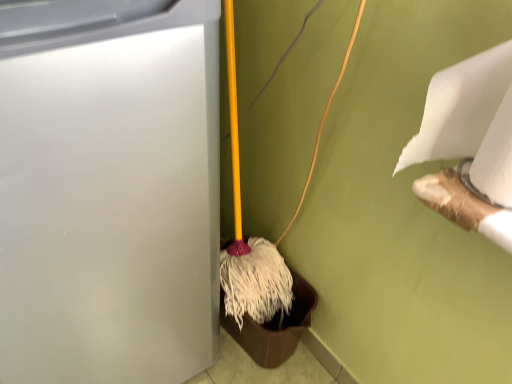
Locate an element on the screen. white matte toilet paper at upper right, placed as the 2th toilet paper when sorted from right to left is located at coordinates (460, 107).

Measure the distance between point (496, 183) and camera.

Point (496, 183) and camera are 21.14 inches apart from each other.

The width and height of the screenshot is (512, 384). What do you see at coordinates (108, 189) in the screenshot?
I see `white matte waste container at left` at bounding box center [108, 189].

Where is `white matte toilet paper at upper right, positioned as the 1th toilet paper in left-to-right order`? The height and width of the screenshot is (384, 512). white matte toilet paper at upper right, positioned as the 1th toilet paper in left-to-right order is located at coordinates [x=460, y=107].

In the scene shown: Which of these two, white matte toilet paper at upper right, positioned as the 1th toilet paper in left-to-right order, or white matte waste container at left, is bigger?

Bigger between the two is white matte waste container at left.

Consider the image. Which is correct: white matte toilet paper at upper right, positioned as the 1th toilet paper in left-to-right order, is inside white matte waste container at left, or outside of it?

white matte toilet paper at upper right, positioned as the 1th toilet paper in left-to-right order, cannot be found inside white matte waste container at left.

From the image's perspective, is white matte toilet paper at upper right, positioned as the 1th toilet paper in left-to-right order, above white matte waste container at left?

Indeed, from the image's perspective, white matte toilet paper at upper right, positioned as the 1th toilet paper in left-to-right order, is shown above white matte waste container at left.

Based on the photo, is white matte toilet paper at upper right, positioned as the 1th toilet paper in left-to-right order, taller than white matte waste container at left?

Incorrect, the height of white matte toilet paper at upper right, positioned as the 1th toilet paper in left-to-right order, is not larger of that of white matte waste container at left.

Locate an element on the screen. toilet paper that appears in front of the white matte toilet paper at upper right, positioned as the 1th toilet paper in left-to-right order is located at coordinates (495, 158).

Is white matte toilet paper at upper right, positioned as the 1th toilet paper in left-to-right order, next to white matte toilet paper at upper right, which is the 1th toilet paper in right-to-left order?

Yes, white matte toilet paper at upper right, positioned as the 1th toilet paper in left-to-right order, is right next to white matte toilet paper at upper right, which is the 1th toilet paper in right-to-left order, and making contact.

From the image's perspective, does white matte toilet paper at upper right, placed as the 2th toilet paper when sorted from right to left, appear lower than white matte toilet paper at upper right, which is the second toilet paper in left-to-right order?

Correct, white matte toilet paper at upper right, placed as the 2th toilet paper when sorted from right to left, appears lower than white matte toilet paper at upper right, which is the second toilet paper in left-to-right order, in the image.

Find the location of `waste container lying on the left of white matte toilet paper at upper right, which is the 1th toilet paper in right-to-left order`. waste container lying on the left of white matte toilet paper at upper right, which is the 1th toilet paper in right-to-left order is located at coordinates (108, 189).

Is white matte toilet paper at upper right, which is the 1th toilet paper in right-to-left order, wider or thinner than white matte waste container at left?

Considering their sizes, white matte toilet paper at upper right, which is the 1th toilet paper in right-to-left order, looks slimmer than white matte waste container at left.

From a real-world perspective, who is located higher, white matte toilet paper at upper right, which is the 1th toilet paper in right-to-left order, or white matte waste container at left?

white matte toilet paper at upper right, which is the 1th toilet paper in right-to-left order, from a real-world perspective.

Does point (508, 175) come closer to viewer compared to point (54, 251)?

Yes.

Do you think white matte toilet paper at upper right, which is the second toilet paper in left-to-right order, is within white matte toilet paper at upper right, placed as the 2th toilet paper when sorted from right to left, or outside of it?

white matte toilet paper at upper right, which is the second toilet paper in left-to-right order, is inside white matte toilet paper at upper right, placed as the 2th toilet paper when sorted from right to left.

How many degrees apart are the facing directions of white matte toilet paper at upper right, which is the second toilet paper in left-to-right order, and white matte toilet paper at upper right, positioned as the 1th toilet paper in left-to-right order?

The angle between the facing direction of white matte toilet paper at upper right, which is the second toilet paper in left-to-right order, and the facing direction of white matte toilet paper at upper right, positioned as the 1th toilet paper in left-to-right order, is 0.978 degrees.

From the image's perspective, is white matte toilet paper at upper right, which is the second toilet paper in left-to-right order, positioned above or below white matte toilet paper at upper right, placed as the 2th toilet paper when sorted from right to left?

white matte toilet paper at upper right, which is the second toilet paper in left-to-right order, is above white matte toilet paper at upper right, placed as the 2th toilet paper when sorted from right to left.

Identify the location of toilet paper behind the white matte toilet paper at upper right, which is the 1th toilet paper in right-to-left order. The width and height of the screenshot is (512, 384). (460, 107).

Is white matte waste container at left positioned far away from white matte toilet paper at upper right, which is the 1th toilet paper in right-to-left order?

That's not correct — white matte waste container at left is a little close to white matte toilet paper at upper right, which is the 1th toilet paper in right-to-left order.

From the picture: Can you confirm if white matte waste container at left is shorter than white matte toilet paper at upper right, which is the 1th toilet paper in right-to-left order?

No.

Is white matte waste container at left positioned with its back to white matte toilet paper at upper right, which is the 1th toilet paper in right-to-left order?

That's not correct — white matte waste container at left is not looking away from white matte toilet paper at upper right, which is the 1th toilet paper in right-to-left order.

Who is smaller, white matte waste container at left or white matte toilet paper at upper right, placed as the 2th toilet paper when sorted from right to left?

white matte toilet paper at upper right, placed as the 2th toilet paper when sorted from right to left, is smaller.

Between white matte waste container at left and white matte toilet paper at upper right, placed as the 2th toilet paper when sorted from right to left, which one appears on the left side from the viewer's perspective?

Positioned to the left is white matte waste container at left.

Could you measure the distance between white matte waste container at left and white matte toilet paper at upper right, positioned as the 1th toilet paper in left-to-right order?

A distance of 19.24 inches exists between white matte waste container at left and white matte toilet paper at upper right, positioned as the 1th toilet paper in left-to-right order.

What's the angular difference between white matte waste container at left and white matte toilet paper at upper right, placed as the 2th toilet paper when sorted from right to left,'s facing directions?

They differ by 90.6 degrees in their facing directions.

Identify the location of waste container below the white matte toilet paper at upper right, positioned as the 1th toilet paper in left-to-right order (from the image's perspective). (108, 189).

Image resolution: width=512 pixels, height=384 pixels. In order to click on toilet paper behind the white matte toilet paper at upper right, which is the second toilet paper in left-to-right order in this screenshot , I will do `click(460, 107)`.

Estimate the real-world distances between objects in this image. Which object is closer to white matte waste container at left, white matte toilet paper at upper right, which is the 1th toilet paper in right-to-left order, or white matte toilet paper at upper right, placed as the 2th toilet paper when sorted from right to left?

white matte toilet paper at upper right, placed as the 2th toilet paper when sorted from right to left, is closer to white matte waste container at left.

Based on their spatial positions, is white matte toilet paper at upper right, placed as the 2th toilet paper when sorted from right to left, or white matte waste container at left closer to white matte toilet paper at upper right, which is the 1th toilet paper in right-to-left order?

The object closer to white matte toilet paper at upper right, which is the 1th toilet paper in right-to-left order, is white matte toilet paper at upper right, placed as the 2th toilet paper when sorted from right to left.

Consider the image. Which object lies further to the anchor point white matte toilet paper at upper right, positioned as the 1th toilet paper in left-to-right order, white matte waste container at left or white matte toilet paper at upper right, which is the second toilet paper in left-to-right order?

white matte waste container at left is positioned further to the anchor white matte toilet paper at upper right, positioned as the 1th toilet paper in left-to-right order.

Considering their positions, is white matte toilet paper at upper right, which is the second toilet paper in left-to-right order, positioned closer to white matte toilet paper at upper right, positioned as the 1th toilet paper in left-to-right order, than white matte waste container at left?

The object closer to white matte toilet paper at upper right, positioned as the 1th toilet paper in left-to-right order, is white matte toilet paper at upper right, which is the second toilet paper in left-to-right order.

Which object lies nearer to the anchor point white matte waste container at left, white matte toilet paper at upper right, positioned as the 1th toilet paper in left-to-right order, or white matte toilet paper at upper right, which is the 1th toilet paper in right-to-left order?

Among the two, white matte toilet paper at upper right, positioned as the 1th toilet paper in left-to-right order, is located nearer to white matte waste container at left.

Consider the image. When comparing their distances from white matte toilet paper at upper right, which is the second toilet paper in left-to-right order, does white matte waste container at left or white matte toilet paper at upper right, placed as the 2th toilet paper when sorted from right to left, seem further?

white matte waste container at left.

This screenshot has width=512, height=384. I want to click on toilet paper situated between white matte waste container at left and white matte toilet paper at upper right, which is the 1th toilet paper in right-to-left order, from left to right, so click(x=460, y=107).